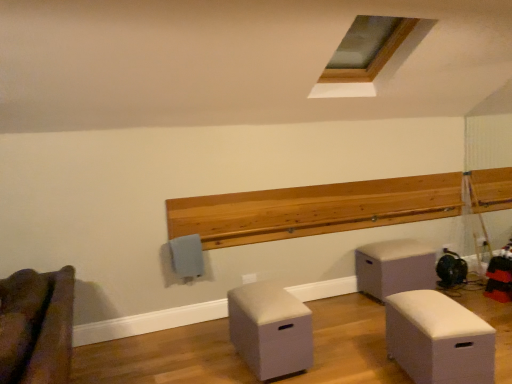
Question: Is brown fabric couch at lower left, which appears as the 4th furniture when viewed from the right, in front of or behind beige fabric ottoman at center, which is the 2th furniture from left to right, in the image?

Choices:
 (A) behind
 (B) front

Answer: (B)

Question: Considering the positions of brown fabric couch at lower left, which appears as the 4th furniture when viewed from the right, and beige fabric ottoman at center, which ranks as the third furniture in right-to-left order, in the image, is brown fabric couch at lower left, which appears as the 4th furniture when viewed from the right, bigger or smaller than beige fabric ottoman at center, which ranks as the third furniture in right-to-left order,?

Choices:
 (A) small
 (B) big

Answer: (B)

Question: Which is farther from the white matte storage box at lower right, arranged as the third furniture when viewed from the left?

Choices:
 (A) matte gray ottoman at center right, which is the first furniture from right to left
 (B) clear glass window at upper center
 (C) brown fabric couch at lower left, the first furniture when ordered from left to right
 (D) beige fabric ottoman at center, which is the 2th furniture from left to right
 (E) wooden ledge at upper center

Answer: (B)

Question: Estimate the real-world distances between objects in this image. Which object is closer to the white matte storage box at lower right, acting as the second furniture starting from the right?

Choices:
 (A) beige fabric ottoman at center, which is the 2th furniture from left to right
 (B) matte gray ottoman at center right, the 4th furniture positioned from the left
 (C) clear glass window at upper center
 (D) brown fabric couch at lower left, the first furniture when ordered from left to right
 (E) wooden ledge at upper center

Answer: (A)